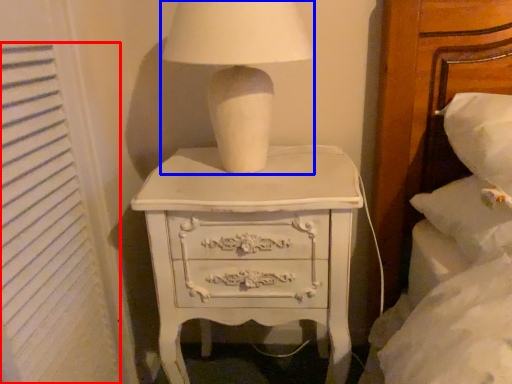
Question: Which point is closer to the camera, curtain (highlighted by a red box) or table lamp (highlighted by a blue box)?

Choices:
 (A) curtain
 (B) table lamp

Answer: (A)